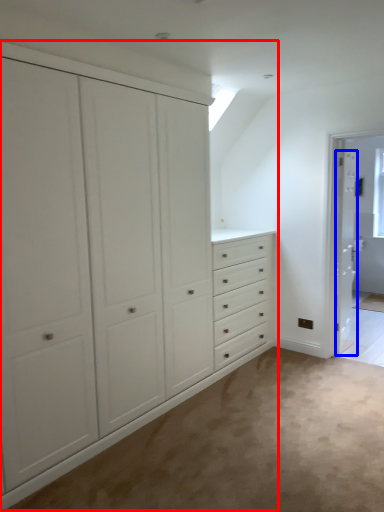
Question: Among these objects, which one is farthest to the camera, cupboard (highlighted by a red box) or door (highlighted by a blue box)?

Choices:
 (A) cupboard
 (B) door

Answer: (B)